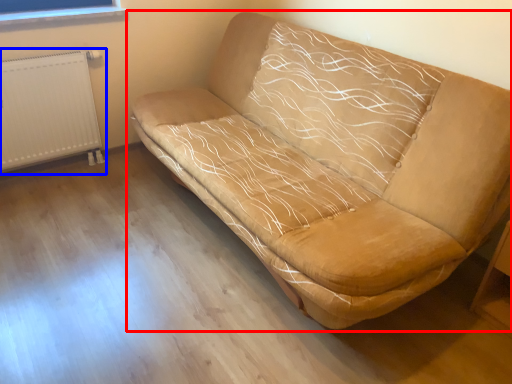
Question: Which object appears closest to the camera in this image, studio couch (highlighted by a red box) or radiator (highlighted by a blue box)?

Choices:
 (A) studio couch
 (B) radiator

Answer: (A)